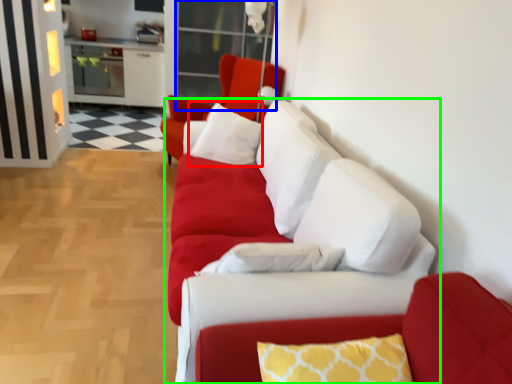
Question: Which is nearer to the pillow (highlighted by a red box)? glass door (highlighted by a blue box) or studio couch (highlighted by a green box).

Choices:
 (A) glass door
 (B) studio couch

Answer: (B)